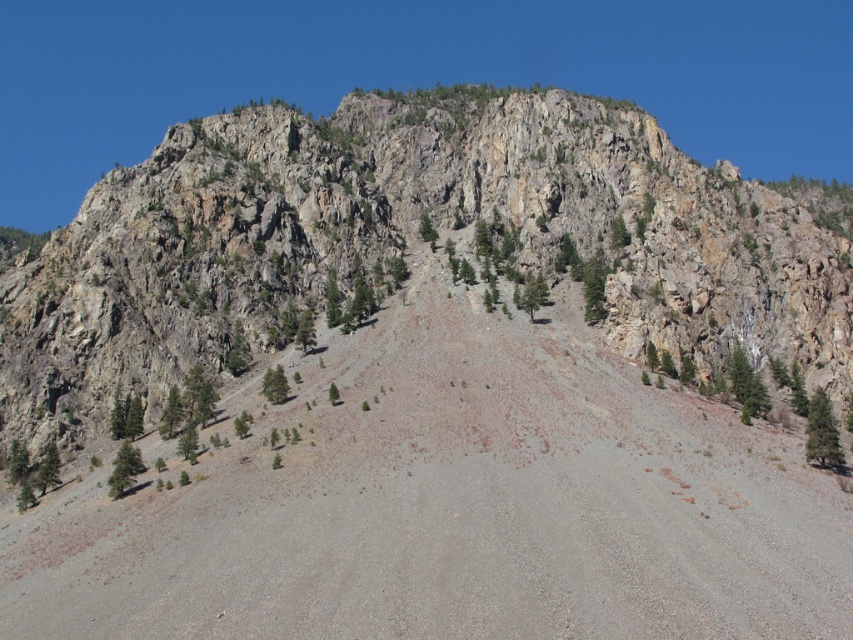
Question: Among these objects, which one is nearest to the camera?

Choices:
 (A) gray gravel dirt track at center
 (B) rocky cliff at upper center

Answer: (A)

Question: Does gray gravel dirt track at center appear over rocky cliff at upper center?

Choices:
 (A) yes
 (B) no

Answer: (B)

Question: Can you confirm if gray gravel dirt track at center is positioned to the left of rocky cliff at upper center?

Choices:
 (A) no
 (B) yes

Answer: (B)

Question: Which of the following is the farthest from the observer?

Choices:
 (A) (799, 221)
 (B) (227, 472)

Answer: (A)

Question: Does gray gravel dirt track at center have a lesser width compared to rocky cliff at upper center?

Choices:
 (A) yes
 (B) no

Answer: (A)